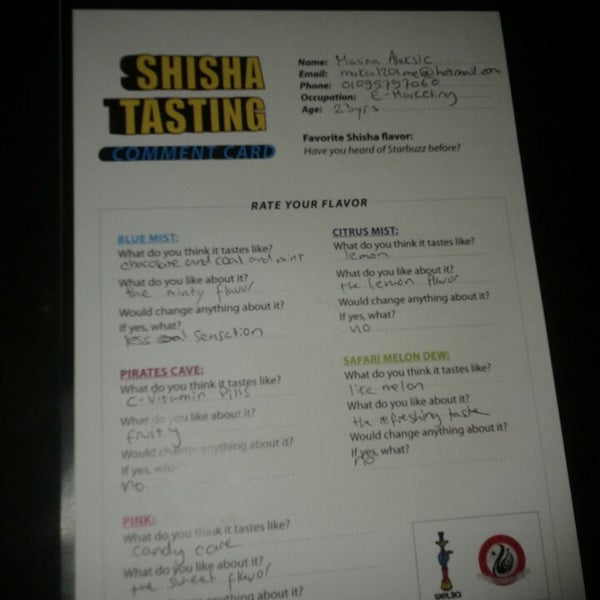
Where is `word art`? The image size is (600, 600). word art is located at coordinates (213, 88), (213, 152).